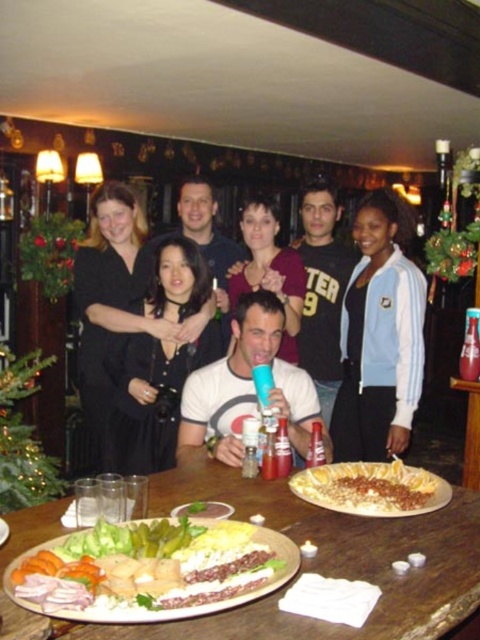
Between blue and white jacket at center and black cotton shirt at center, which one is positioned lower?

Positioned lower is blue and white jacket at center.

Between blue and white jacket at center and black cotton shirt at center, which one has less height?

black cotton shirt at center is shorter.

Which is in front, point (400, 378) or point (301, 330)?

Point (400, 378)

The height and width of the screenshot is (640, 480). In order to click on blue and white jacket at center in this screenshot , I will do `click(380, 339)`.

Does pickled vegetables at center appear under white matte t-shirt at center?

Indeed, pickled vegetables at center is positioned under white matte t-shirt at center.

Which is below, pickled vegetables at center or white matte t-shirt at center?

pickled vegetables at center is lower down.

Which is in front, point (144, 525) or point (300, 435)?

Point (144, 525) is more forward.

Find the location of a particular element. This screenshot has width=480, height=640. pickled vegetables at center is located at coordinates (151, 572).

Between wooden table at center and green leafy salad at center, which one appears on the left side from the viewer's perspective?

green leafy salad at center

Does wooden table at center have a greater height compared to green leafy salad at center?

Correct, wooden table at center is much taller as green leafy salad at center.

Is point (445, 513) less distant than point (211, 512)?

No.

Image resolution: width=480 pixels, height=640 pixels. Find the location of `wooden table at center`. wooden table at center is located at coordinates (327, 563).